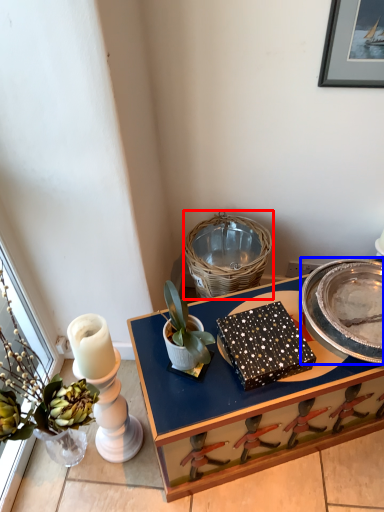
Question: Among these objects, which one is farthest to the camera, basket (highlighted by a red box) or plate (highlighted by a blue box)?

Choices:
 (A) basket
 (B) plate

Answer: (A)